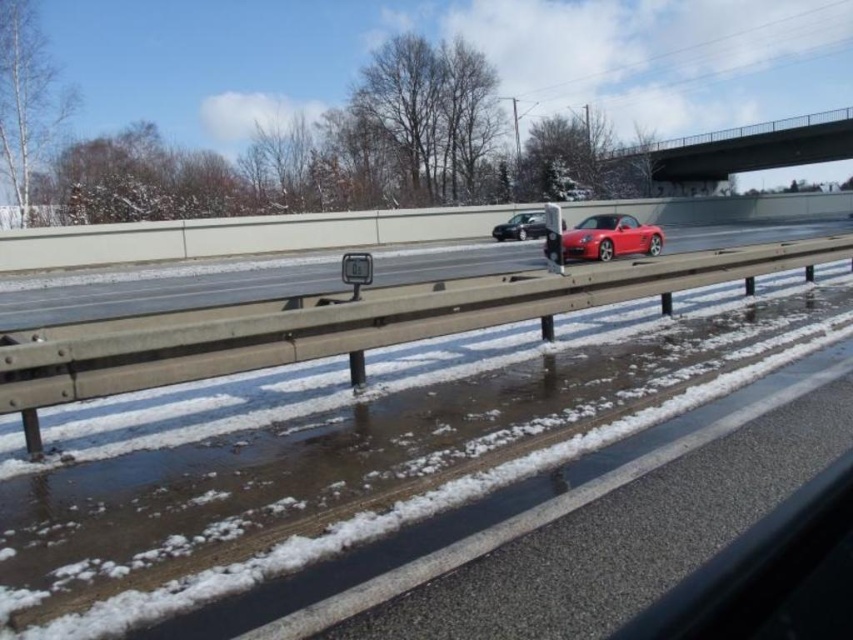
Question: Which point is farther to the camera?

Choices:
 (A) glossy red convertible at center
 (B) concrete bridge at upper center

Answer: (B)

Question: Does concrete bridge at upper center have a larger size compared to satin black car at center?

Choices:
 (A) no
 (B) yes

Answer: (B)

Question: Is concrete bridge at upper center below satin black car at center?

Choices:
 (A) no
 (B) yes

Answer: (A)

Question: Among these objects, which one is nearest to the camera?

Choices:
 (A) concrete bridge at upper center
 (B) glossy red convertible at center

Answer: (B)

Question: Does concrete bridge at upper center have a lesser width compared to satin black car at center?

Choices:
 (A) no
 (B) yes

Answer: (A)

Question: Which point is farther to the camera?

Choices:
 (A) (637, 250)
 (B) (515, 236)
 (C) (741, 128)

Answer: (C)